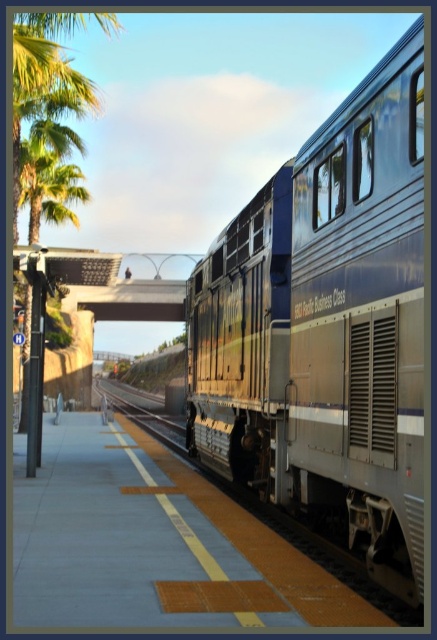
Who is taller, smooth concrete platform at center or metal train track at center?

With more height is metal train track at center.

Does point (75, 620) come closer to viewer compared to point (152, 408)?

Yes, it is.

Find the location of a particular element. Image resolution: width=437 pixels, height=640 pixels. smooth concrete platform at center is located at coordinates 153,544.

Who is shorter, metallic blue train at right or smooth concrete platform at center?

Standing shorter between the two is smooth concrete platform at center.

Which is above, metallic blue train at right or smooth concrete platform at center?

metallic blue train at right is above.

Does point (257, 461) lie behind point (155, 442)?

No, it is in front of (155, 442).

Image resolution: width=437 pixels, height=640 pixels. What are the coordinates of `metallic blue train at right` in the screenshot? It's located at (326, 324).

Does metallic blue train at right appear over metal train track at center?

Yes.

Does metallic blue train at right appear on the right side of metal train track at center?

Correct, you'll find metallic blue train at right to the right of metal train track at center.

I want to click on metallic blue train at right, so (x=326, y=324).